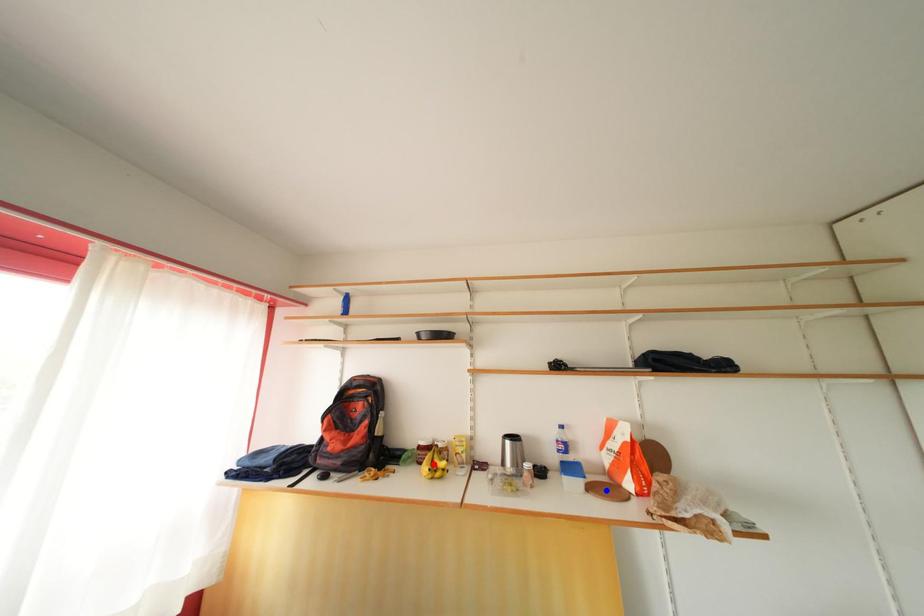
Question: Two points are marked on the image. Which point is closer to the camera?

Choices:
 (A) Blue point is closer.
 (B) Red point is closer.

Answer: (A)